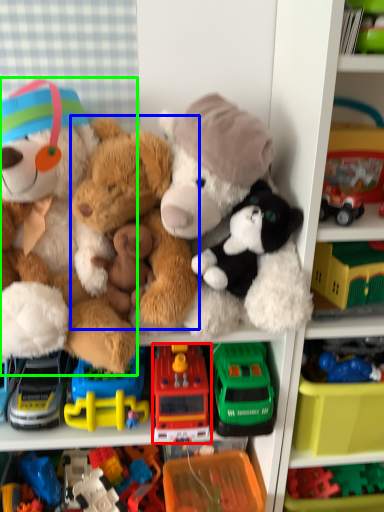
Question: Which object is positioned closest to toy (highlighted by a red box)? Select from teddy bear (highlighted by a blue box) and teddy bear (highlighted by a green box).

Choices:
 (A) teddy bear
 (B) teddy bear

Answer: (A)